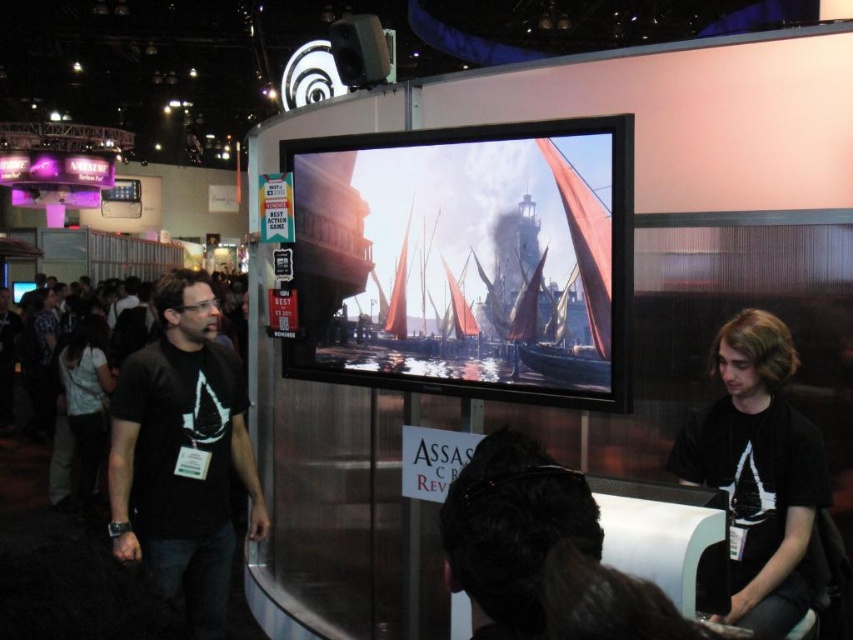
Question: Is the position of black matte hair at lower right more distant than that of white matte shirt at lower left?

Choices:
 (A) yes
 (B) no

Answer: (B)

Question: Which object is closer to the camera taking this photo?

Choices:
 (A) black matte t-shirt at left
 (B) white matte shirt at lower left

Answer: (A)

Question: Does matte black screen at center appear under black matte hair at lower right?

Choices:
 (A) no
 (B) yes

Answer: (A)

Question: Considering the real-world distances, which object is closest to the white matte shirt at lower left?

Choices:
 (A) black matte hair at lower right
 (B) black matte t-shirt at left
 (C) matte black screen at center

Answer: (B)

Question: In this image, where is black matte hair at lower right located relative to white matte shirt at lower left?

Choices:
 (A) below
 (B) above

Answer: (B)

Question: Which object appears farthest from the camera in this image?

Choices:
 (A) black matte t-shirt at left
 (B) white matte shirt at lower left
 (C) matte black screen at center
 (D) black matte hair at lower right

Answer: (B)